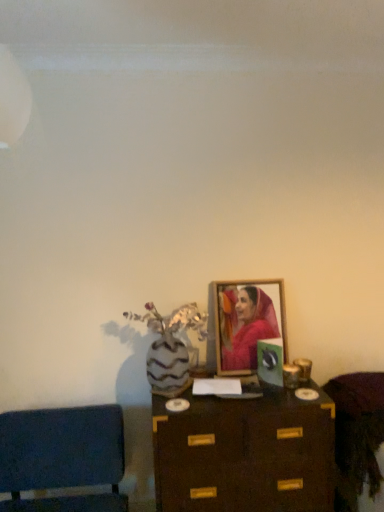
Question: From the image's perspective, is velvet blue cushion at lower left, placed as the 1th furniture when sorted from left to right, positioned above or below wooden framed portrait at center?

Choices:
 (A) above
 (B) below

Answer: (B)

Question: Is velvet blue cushion at lower left, the 2th furniture in the right-to-left sequence, in front of or behind wooden framed portrait at center in the image?

Choices:
 (A) behind
 (B) front

Answer: (B)

Question: Which object is positioned closest to the wooden cabinet at lower right, acting as the 1th furniture starting from the right?

Choices:
 (A) brown wooden table at center
 (B) velvet blue cushion at lower left, the 2th furniture in the right-to-left sequence
 (C) wooden framed portrait at center

Answer: (A)

Question: Estimate the real-world distances between objects in this image. Which object is farther from the wooden framed portrait at center?

Choices:
 (A) brown wooden table at center
 (B) velvet blue cushion at lower left, the 2th furniture in the right-to-left sequence
 (C) wooden cabinet at lower right, acting as the 1th furniture starting from the right

Answer: (B)